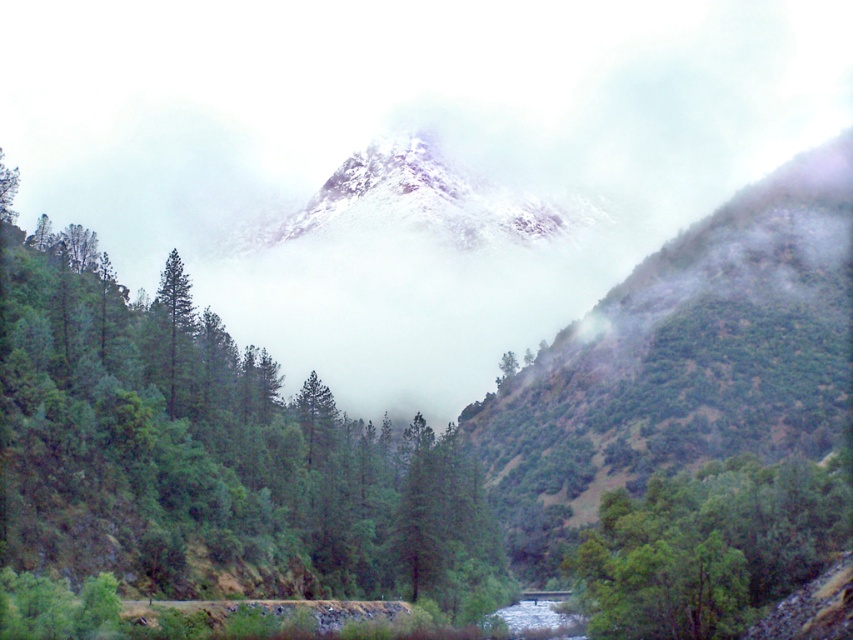
You are standing in the valley and want to walk from the green leafy tree at lower right to the green matte tree at left. Which direction should you head?

You should head to the left because the green leafy tree at lower right is positioned on the right side of the green matte tree at left.

You are standing at the point marked as point (706, 547) in the lower right of the image. Looking towards the green leafy tree at lower right, which direction should you walk to reach the flowing river or stream in the valley floor?

The green leafy tree at lower right is located at point (706, 547). Since the river is flowing through the valley floor in the foreground, you should walk towards the lower part of the image to reach the river.

You are a hiker trying to cross the valley. You have a map that shows the green matte tree at center and the green leafy tree at lower right. According to the map, which tree has a wider trunk? Please refer to the spatial details provided.

The green matte tree at center has a larger width than the green leafy tree at lower right, so its trunk is wider.